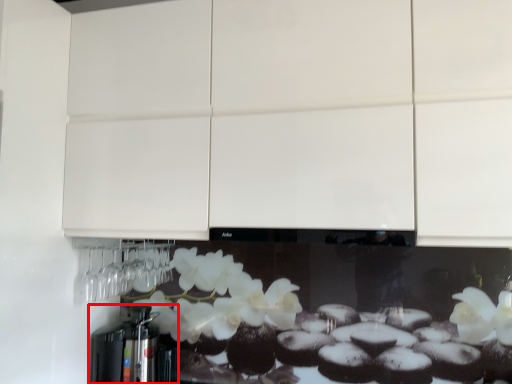
Question: Considering the relative positions of coffee machine (annotated by the red box) and cabinetry in the image provided, where is coffee machine (annotated by the red box) located with respect to the staircase?

Choices:
 (A) right
 (B) left

Answer: (B)